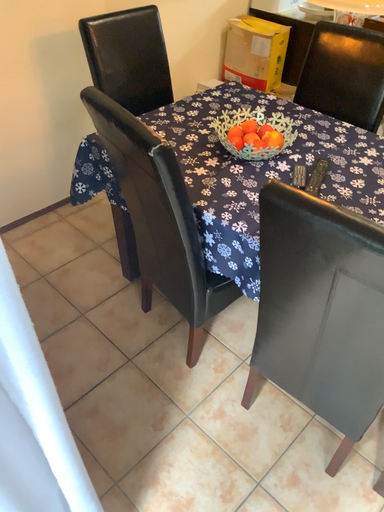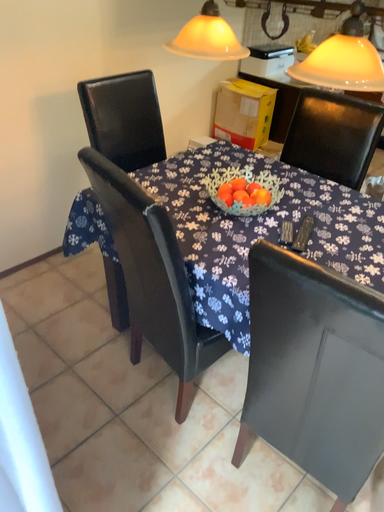
Question: How did the camera likely rotate when shooting the video?

Choices:
 (A) rotated upward
 (B) rotated downward

Answer: (A)